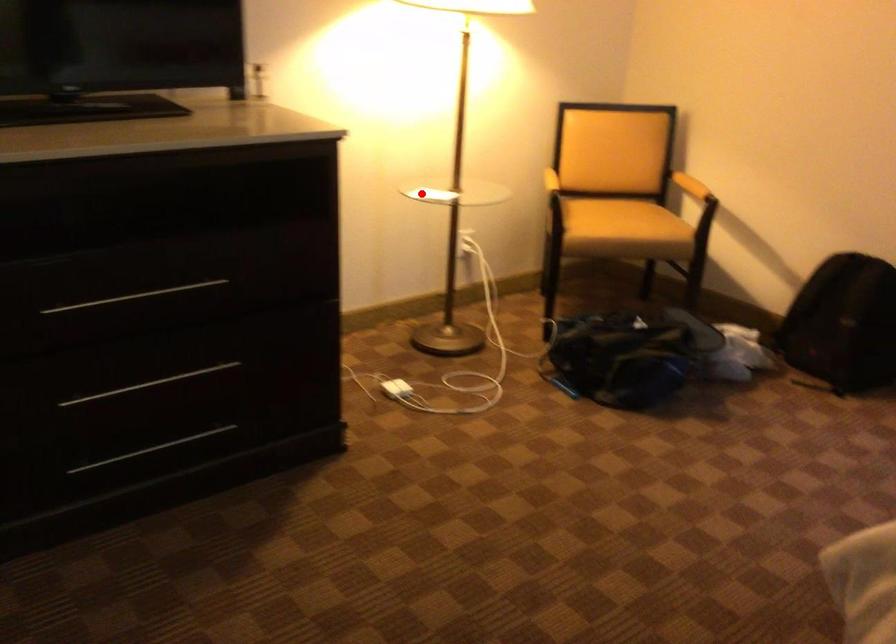
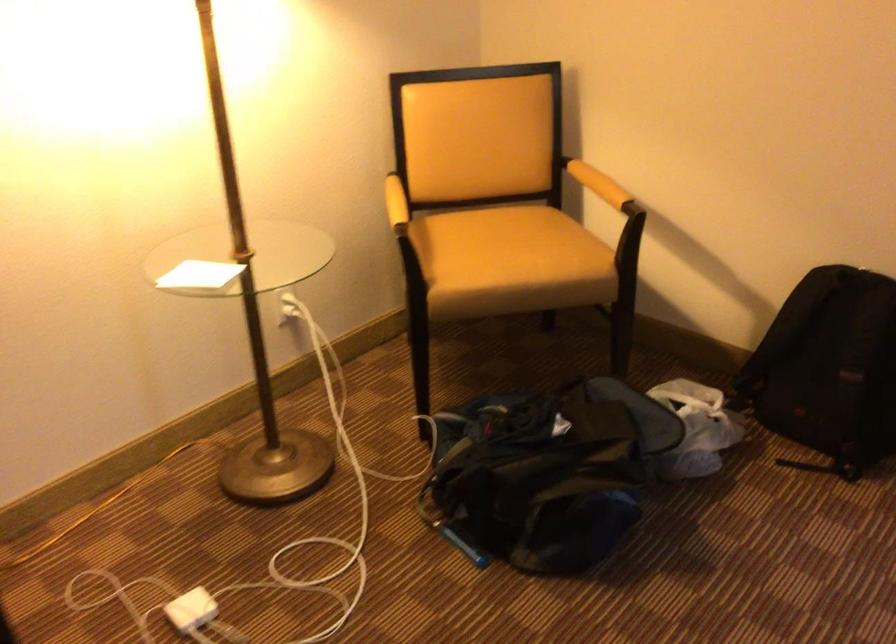
Question: I am providing you with two images of the same scene from different viewpoints. In image1, a red point is highlighted. Considering the same 3D point in image2, which of the following is correct?

Choices:
 (A) It is closer
 (B) It is farther

Answer: (A)